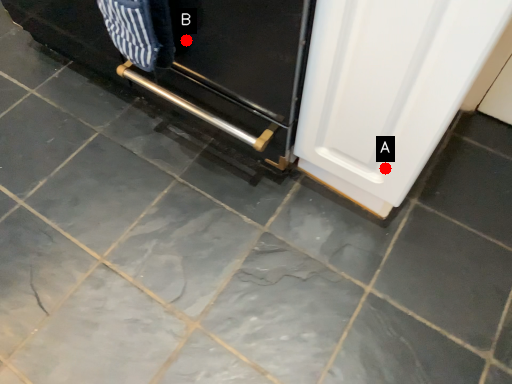
Question: Two points are circled on the image, labeled by A and B beside each circle. Among these points, which one is farthest from the camera?

Choices:
 (A) A is further
 (B) B is further

Answer: (B)